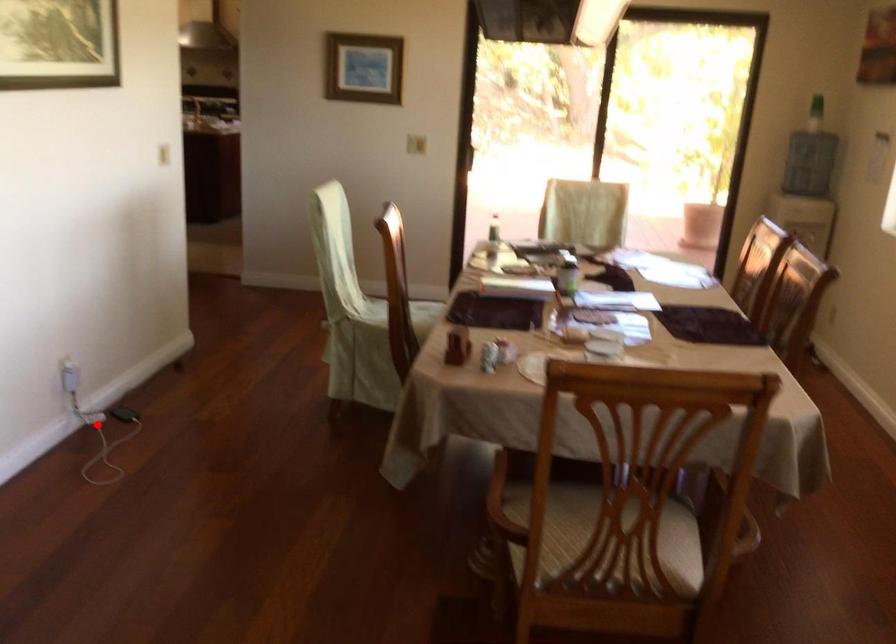
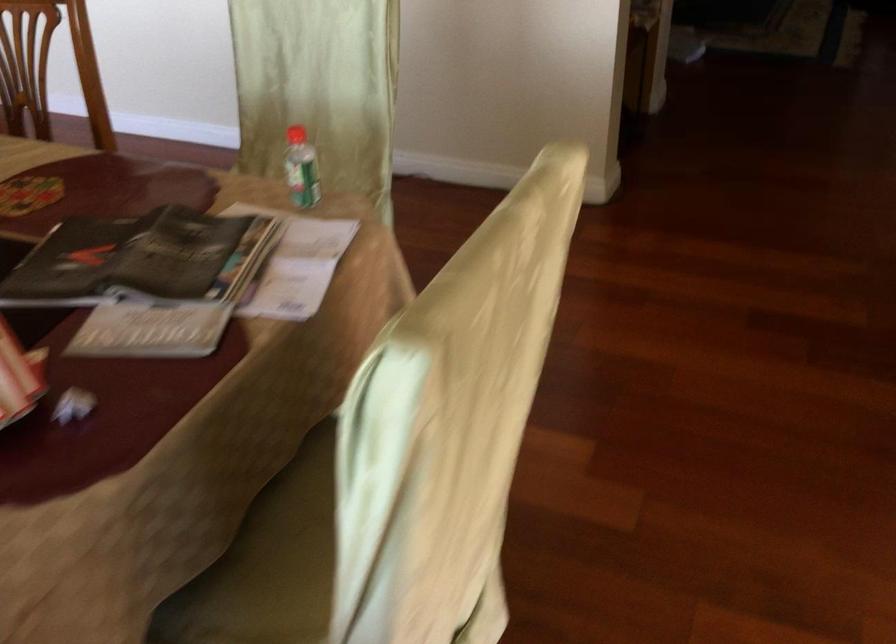
Question: I am providing you with two images of the same scene from different viewpoints. A red point is marked on the first image. Is the red point's position out of view in image 2?

Choices:
 (A) Yes
 (B) No

Answer: (A)